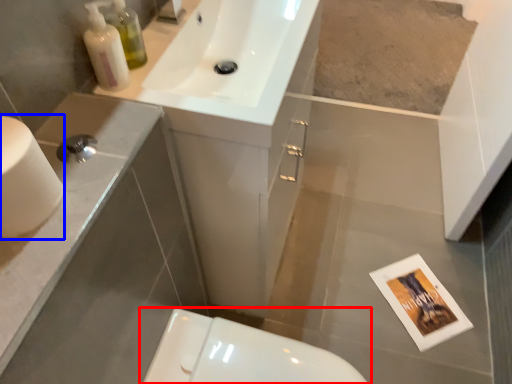
Question: Which object appears farthest to the camera in this image, toilet (highlighted by a red box) or toilet paper (highlighted by a blue box)?

Choices:
 (A) toilet
 (B) toilet paper

Answer: (A)